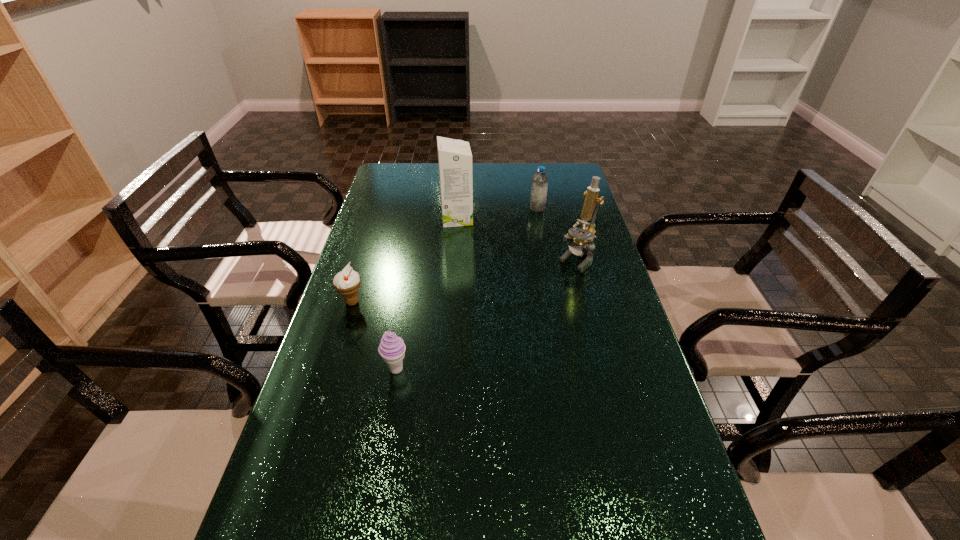
Identify the location of free spot between the third farthest object and the farther icecream. (465, 280).

Locate an element on the screen. The width and height of the screenshot is (960, 540). free space between the rightmost object and the fourth object from left to right is located at coordinates (557, 233).

At what (x,y) coordinates should I click in order to perform the action: click on free space between the third object from right to left and the left icecream. Please return your answer as a coordinate pair (x, y). Looking at the image, I should click on (404, 260).

You are a GUI agent. You are given a task and a screenshot of the screen. Output one action in this format:
    pyautogui.click(x=<x>, y=<y>)
    Task: Click on the free space between the fourth farthest object and the third object from left to right
    This screenshot has height=540, width=960.
    Given the screenshot: What is the action you would take?
    pyautogui.click(x=404, y=260)

Locate an element on the screen. The height and width of the screenshot is (540, 960). free space between the carton and the rightmost object is located at coordinates (516, 239).

Where is `vacant point located between the microscope and the nearer icecream`? vacant point located between the microscope and the nearer icecream is located at coordinates (486, 314).

Identify the location of object that is the third closest to the water bottle. The height and width of the screenshot is (540, 960). (347, 282).

Identify which object is located as the fourth nearest to the third tallest object. Please provide its 2D coordinates. Your answer should be formatted as a tuple, i.e. [(x, y)], where the tuple contains the x and y coordinates of a point satisfying the conditions above.

[(392, 348)]

Locate an element on the screen. The height and width of the screenshot is (540, 960). icecream object that ranks as the second closest to the fourth object from left to right is located at coordinates (392, 348).

Find the location of a particular element. free space that satisfies the following two spatial constraints: 1. on the front side of the second object from left to right; 2. on the left side of the left icecream is located at coordinates (331, 369).